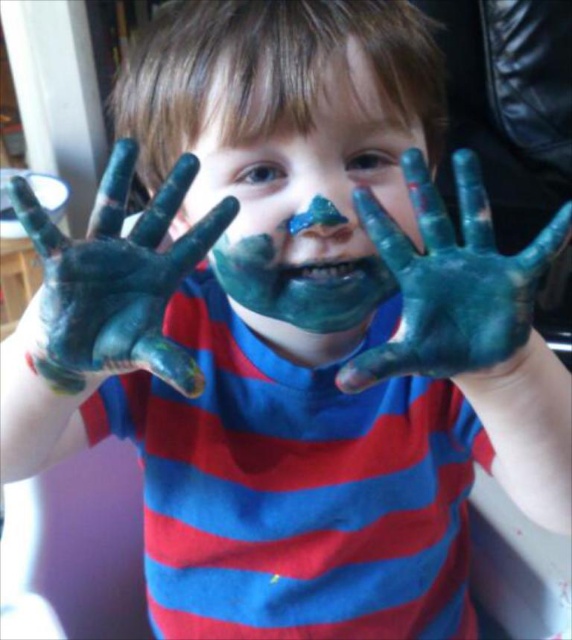
Question: Does matte blue paint at center appear on the right side of blue matte hands at center?

Choices:
 (A) no
 (B) yes

Answer: (A)

Question: Which point is farther from the camera taking this photo?

Choices:
 (A) (496, 301)
 (B) (348, 205)

Answer: (B)

Question: Which object is positioned farthest from the blue matte hands at center?

Choices:
 (A) blue matte paint at center
 (B) matte blue paint at center

Answer: (A)

Question: In this image, where is matte blue paint at center located relative to blue matte paint at center?

Choices:
 (A) right
 (B) left

Answer: (A)

Question: Is matte blue paint at center closer to camera compared to blue matte paint at center?

Choices:
 (A) yes
 (B) no

Answer: (B)

Question: Based on their relative distances, which object is nearer to the blue matte hands at center?

Choices:
 (A) blue matte paint at center
 (B) matte blue paint at center

Answer: (B)